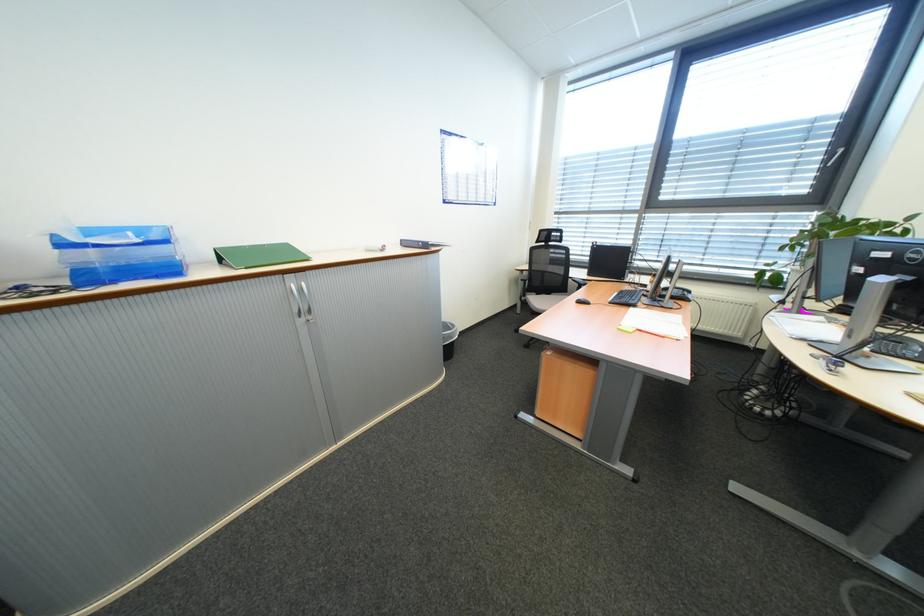
This screenshot has height=616, width=924. Describe the element at coordinates (301, 301) in the screenshot. I see `the silver cabinet handle` at that location.